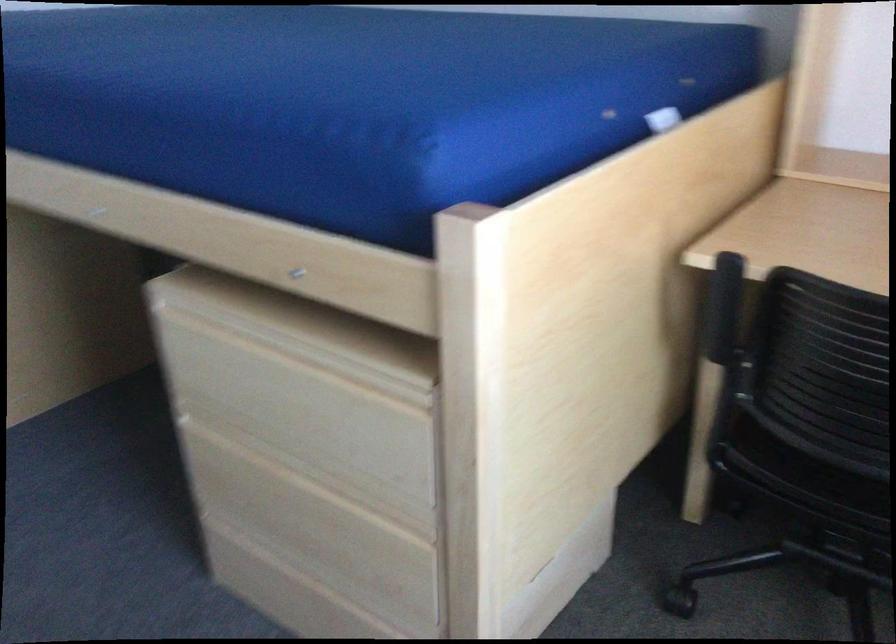
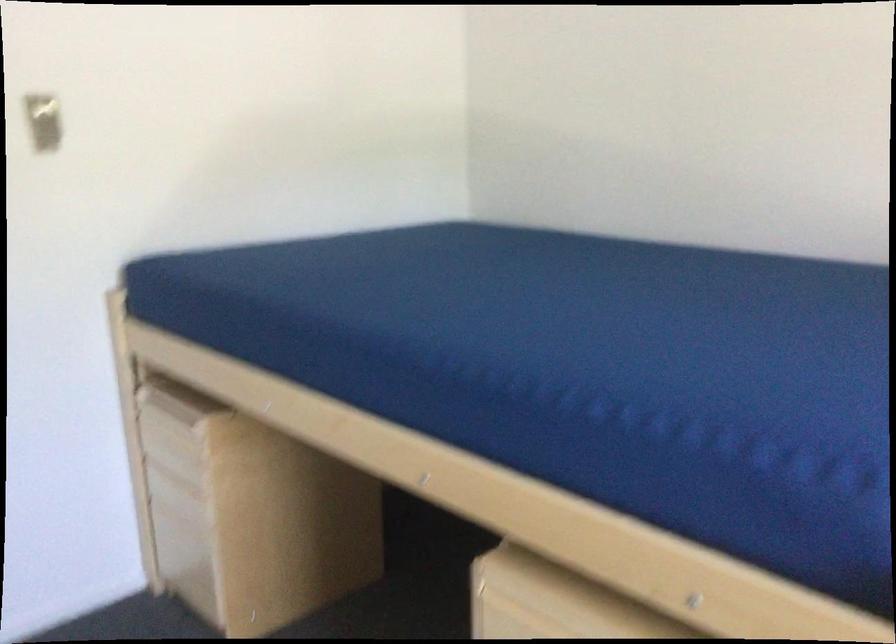
Question: Which direction would the cameraman need to move to produce the second image? Reply with the corresponding letter.

Choices:
 (A) Left
 (B) Right
 (C) Forward
 (D) Backward

Answer: (A)